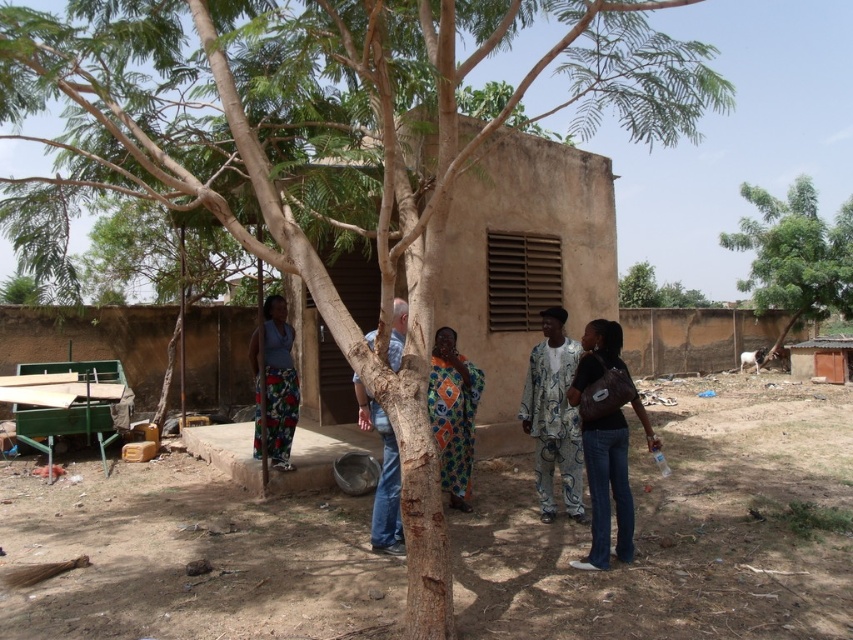
Can you confirm if brown dirt field at lower center is wider than green leafy tree at upper right?

Yes.

Between point (552, 596) and point (758, 200), which one is positioned behind?

The point (758, 200) is more distant.

Between point (714, 412) and point (807, 248), which one is positioned behind?

The point (807, 248) is more distant.

Where is `brown dirt field at lower center`? brown dirt field at lower center is located at coordinates (683, 531).

Is printed fabric shirt at center to the left of blue jeans at center from the viewer's perspective?

No, printed fabric shirt at center is not to the left of blue jeans at center.

Does printed fabric shirt at center appear under blue jeans at center?

Incorrect, printed fabric shirt at center is not positioned below blue jeans at center.

Who is more distant from viewer, (553, 460) or (396, 326)?

The point (553, 460) is more distant.

You are a GUI agent. You are given a task and a screenshot of the screen. Output one action in this format:
    pyautogui.click(x=<x>, y=<y>)
    Task: Click on the printed fabric shirt at center
    
    Given the screenshot: What is the action you would take?
    pyautogui.click(x=553, y=417)

Between point (819, 288) and point (538, 413), which one is positioned behind?

The point (819, 288) is more distant.

What are the coordinates of `green leafy tree at upper right` in the screenshot? It's located at (795, 253).

Where is `green leafy tree at upper right`? The width and height of the screenshot is (853, 640). green leafy tree at upper right is located at coordinates (795, 253).